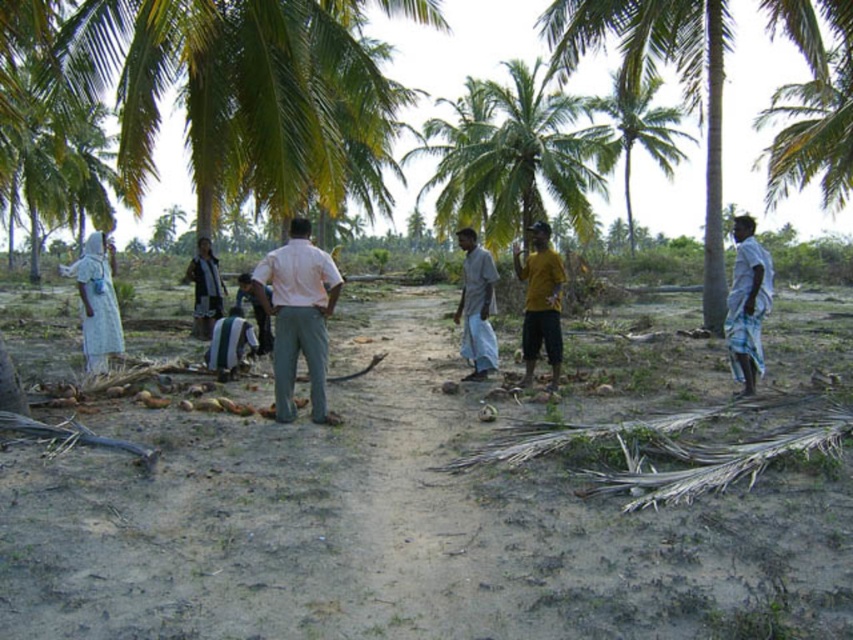
Question: Is brown sandy dirt field at center positioned before green leafy palm tree at upper center?

Choices:
 (A) no
 (B) yes

Answer: (B)

Question: Which object is the farthest from the white woven cloth at right?

Choices:
 (A) pink cotton shirt at center
 (B) green leafy palm tree at center
 (C) white cloth at left

Answer: (B)

Question: Based on their relative distances, which object is nearer to the white cloth at left?

Choices:
 (A) white woven cloth at right
 (B) dark gray fabric shirt at center
 (C) yellow matte shirt at center
 (D) striped fabric shirt at center

Answer: (D)

Question: Is green leafy palm tree at center positioned behind striped fabric shirt at center?

Choices:
 (A) yes
 (B) no

Answer: (A)

Question: Which point appears farthest from the camera in this image?

Choices:
 (A) (93, 268)
 (B) (674, 120)
 (C) (538, 301)

Answer: (B)

Question: Can you confirm if green leafy palm tree at center is positioned to the left of pink cotton shirt at center?

Choices:
 (A) no
 (B) yes

Answer: (A)